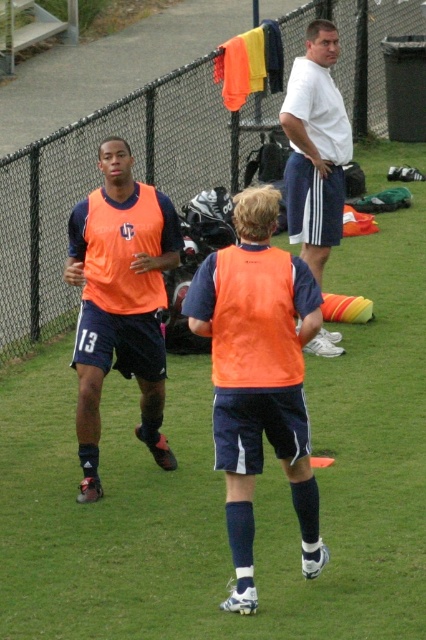
Consider the image. You are a coach standing at the center of the field. You notice two points marked on the field. The first point is at coordinate point (5, 307) and the second point is at coordinate point (94, 296). Which point is closer to your current position?

Point (94, 296) is closer to your current position because it is in front of point (5, 307), which is behind it.

Looking at this image, you are a coach trying to position a cone for a drill. The orange matte vest at center is at coordinates 0.589, 0.608. Where should you place the cone relative to the vest?

The orange matte vest at center is located at point (x=259, y=376), so you should place the cone near those coordinates for the drill.

You are a photographer trying to capture a closeup of the orange matte vest at center and the white cotton shirt at upper center. Given their sizes, which one would require you to move closer to get a clear shot?

The orange matte vest at center occupies less space than the white cotton shirt at upper center, so you would need to move closer to the orange matte vest at center to capture it in clear detail.